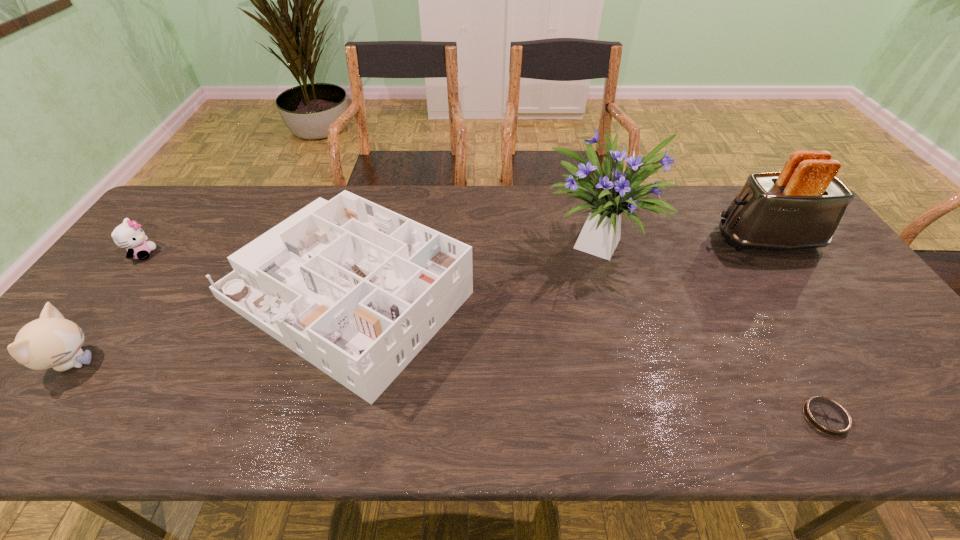
Locate an element on the screen. The image size is (960, 540). compass located at the near edge is located at coordinates (827, 416).

Locate an element on the screen. The image size is (960, 540). object located in the right edge section of the desktop is located at coordinates (800, 207).

Locate an element on the screen. This screenshot has height=540, width=960. object located at the far right corner is located at coordinates (800, 207).

Find the location of a particular element. The image size is (960, 540). free location at the far edge is located at coordinates (233, 204).

Locate an element on the screen. Image resolution: width=960 pixels, height=540 pixels. vacant space at the near edge of the desktop is located at coordinates (405, 441).

Locate an element on the screen. This screenshot has width=960, height=540. free space at the right edge of the desktop is located at coordinates (835, 313).

Find the location of a particular element. The height and width of the screenshot is (540, 960). vacant area at the near left corner is located at coordinates (47, 404).

The image size is (960, 540). Find the location of `vacant area that lies between the flower arrangement and the second tallest object`. vacant area that lies between the flower arrangement and the second tallest object is located at coordinates (684, 240).

The height and width of the screenshot is (540, 960). Identify the location of free space between the flower arrangement and the shortest object. (712, 329).

I want to click on empty space that is in between the compass and the shorter kitten, so click(484, 336).